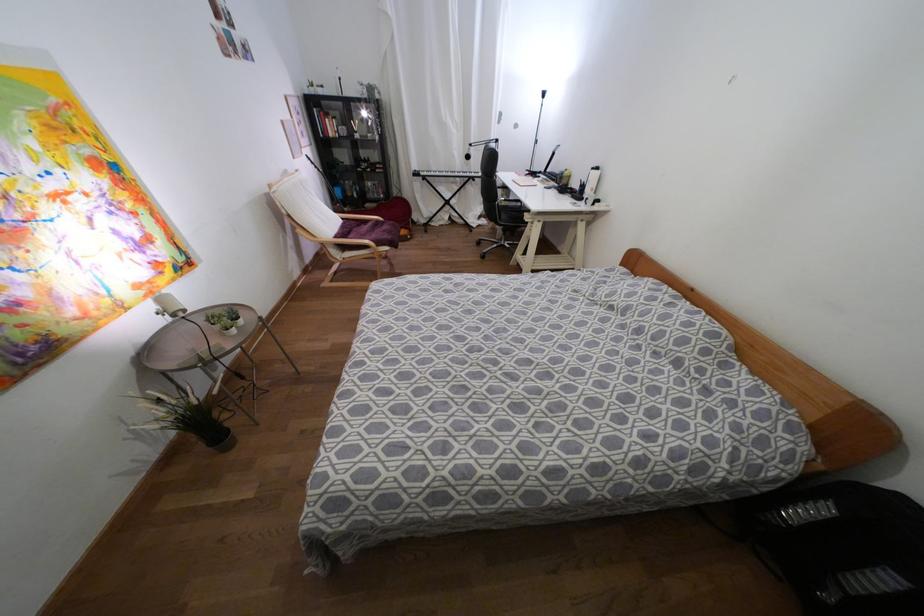
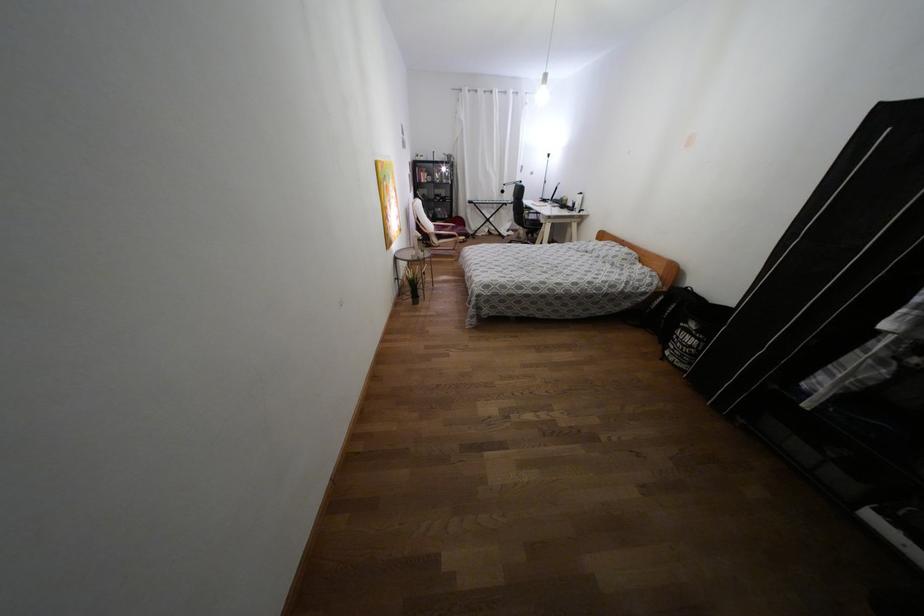
Locate, in the second image, the point that corresponds to [342,246] in the first image.

(439, 237)